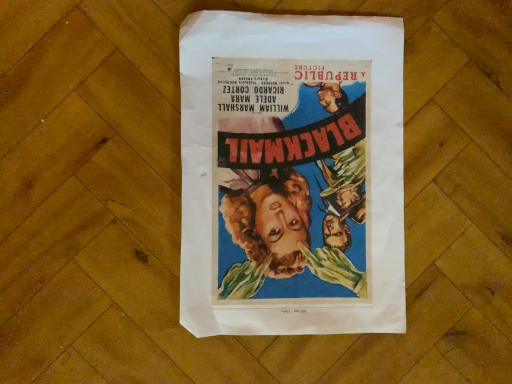
In order to click on free space above vivid paper poster at center (from a real-world perspective) in this screenshot , I will do `click(297, 167)`.